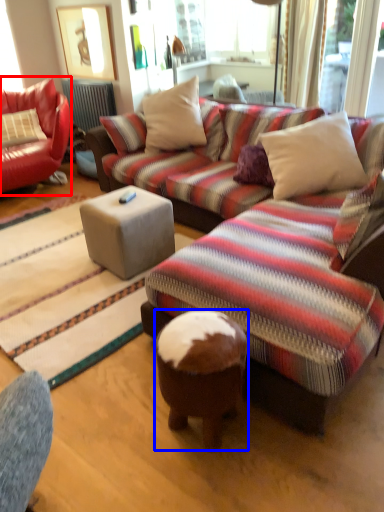
Question: Which object appears closest to the camera in this image, studio couch (highlighted by a red box) or stool (highlighted by a blue box)?

Choices:
 (A) studio couch
 (B) stool

Answer: (B)